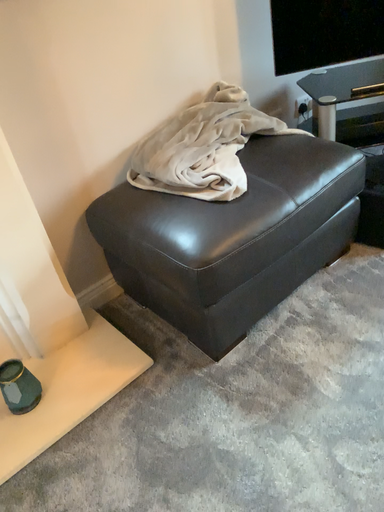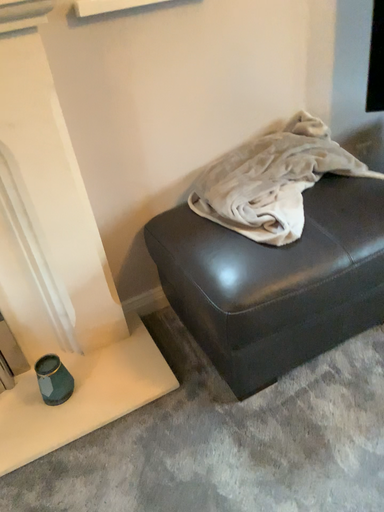
Question: Which way did the camera rotate in the video?

Choices:
 (A) rotated right
 (B) rotated left

Answer: (B)